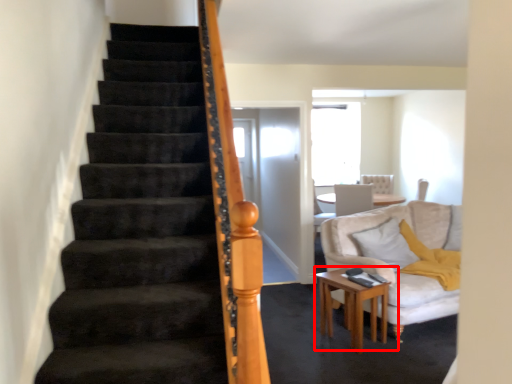
Question: From the image's perspective, considering the relative positions of table (annotated by the red box) and pillow in the image provided, where is table (annotated by the red box) located with respect to the staircase?

Choices:
 (A) below
 (B) above

Answer: (A)